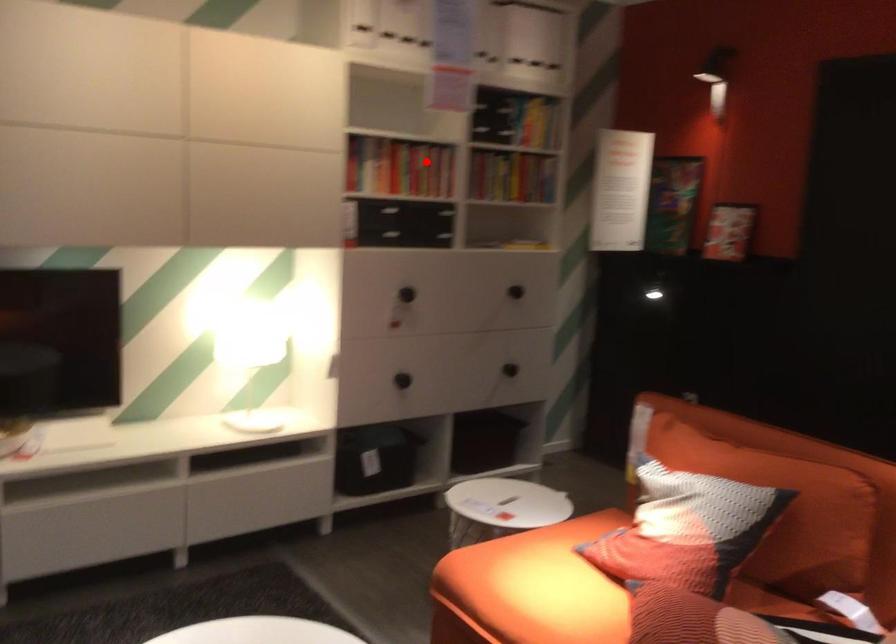
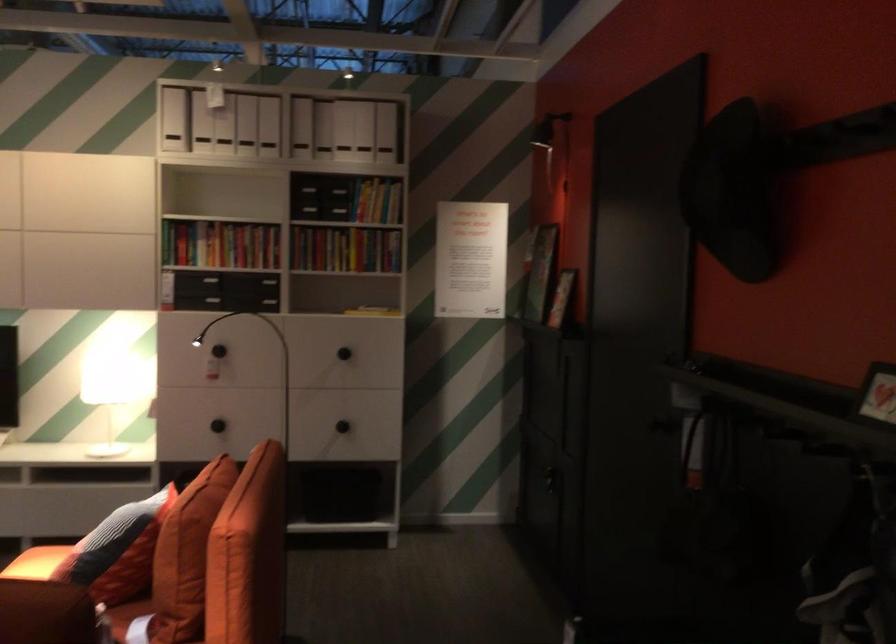
Question: I am providing you with two images of the same scene from different viewpoints. In image1, a red point is highlighted. Considering the same 3D point in image2, which of the following is correct?

Choices:
 (A) It is closer
 (B) It is farther

Answer: (B)